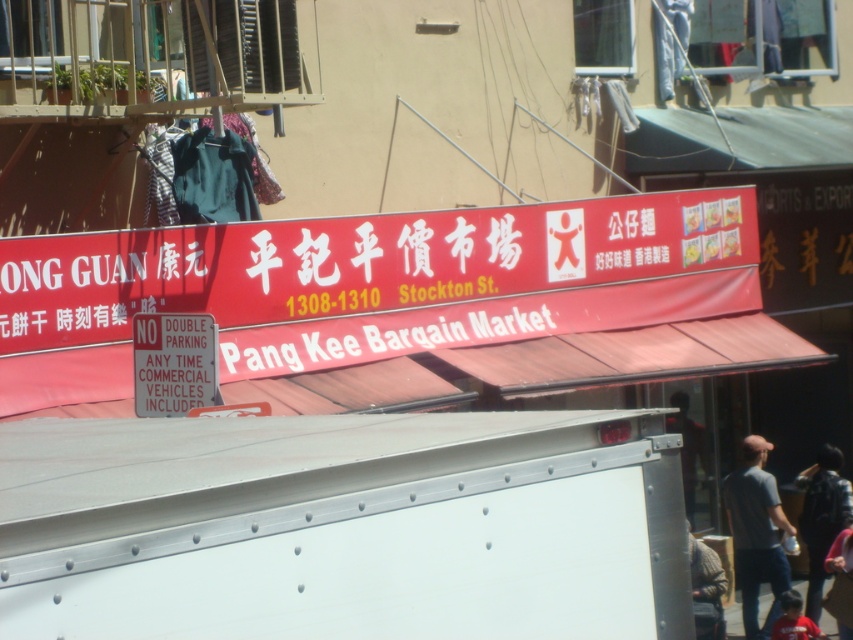
Question: Among these points, which one is nearest to the camera?

Choices:
 (A) (49, 346)
 (B) (277, 193)
 (C) (190, 316)
 (D) (840, 589)

Answer: (C)

Question: Where is brown knitted sweater at lower right located in relation to red shirt at lower right in the image?

Choices:
 (A) below
 (B) above

Answer: (B)

Question: Which object is the farthest from the gray cotton shirt at lower right?

Choices:
 (A) brown knitted sweater at lower right
 (B) dark green fabric at upper left
 (C) red shirt at lower right

Answer: (B)

Question: Which point is farther from the camera taking this photo?

Choices:
 (A) (695, 611)
 (B) (184, 120)
 (C) (838, 536)
 (D) (825, 496)

Answer: (D)

Question: In this image, where is matte plastic sign at center located relative to red shirt at lower right?

Choices:
 (A) below
 (B) above

Answer: (B)

Question: From the image, what is the correct spatial relationship of red matte signboard at upper center in relation to dark red shirt at lower right?

Choices:
 (A) left
 (B) right

Answer: (A)